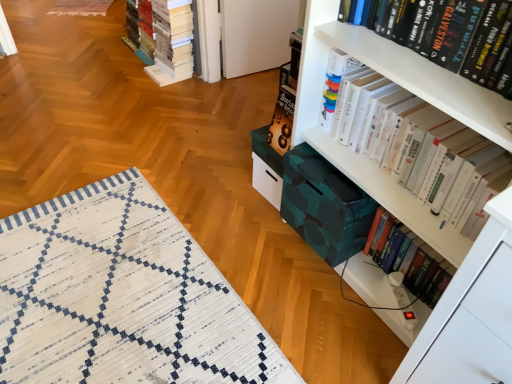
Question: Could hardcover book at lower right, which is the third book from front to back, be considered to be inside hardcover book at upper right, the third book from the right?

Choices:
 (A) yes
 (B) no

Answer: (B)

Question: Can you confirm if hardcover book at upper right, the third book from the right, is smaller than hardcover book at lower right, arranged as the 4th book when viewed from the left?

Choices:
 (A) no
 (B) yes

Answer: (A)

Question: From a real-world perspective, is hardcover book at upper right, the third book from the right, positioned over hardcover book at lower right, acting as the 1th book starting from the right, based on gravity?

Choices:
 (A) no
 (B) yes

Answer: (B)

Question: Is hardcover book at upper right, the second book viewed from the left, behind hardcover book at lower right, placed as the second book when sorted from back to front?

Choices:
 (A) yes
 (B) no

Answer: (B)

Question: Is hardcover book at lower right, which is the third book from front to back, at the back of hardcover book at upper right, which is the fourth book from back to front?

Choices:
 (A) yes
 (B) no

Answer: (B)

Question: Is white glossy book at upper right, acting as the 3th book starting from the left, wider than white woven mat at lower left?

Choices:
 (A) no
 (B) yes

Answer: (A)

Question: Is white glossy book at upper right, positioned as the third book in back-to-front order, not near white woven mat at lower left?

Choices:
 (A) no
 (B) yes

Answer: (A)

Question: Is the surface of white glossy book at upper right, acting as the 3th book starting from the left, in direct contact with white woven mat at lower left?

Choices:
 (A) yes
 (B) no

Answer: (B)

Question: Does white glossy book at upper right, the 2th book viewed from the right, have a lesser width compared to white woven mat at lower left?

Choices:
 (A) no
 (B) yes

Answer: (B)

Question: Considering the relative sizes of white glossy book at upper right, which is counted as the second book, starting from the front, and white woven mat at lower left in the image provided, is white glossy book at upper right, which is counted as the second book, starting from the front, bigger than white woven mat at lower left?

Choices:
 (A) yes
 (B) no

Answer: (B)

Question: Could you tell me if white glossy book at upper right, which is counted as the second book, starting from the front, is facing white woven mat at lower left?

Choices:
 (A) no
 (B) yes

Answer: (A)

Question: Does hardcover book at lower right, placed as the second book when sorted from back to front, appear on the right side of white woven mat at lower left?

Choices:
 (A) yes
 (B) no

Answer: (A)